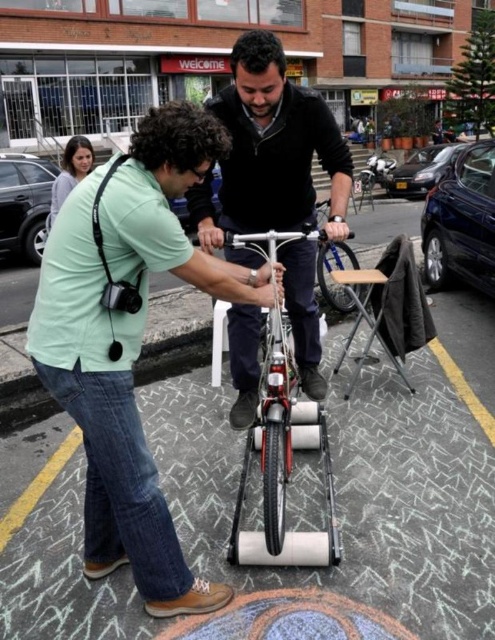
Is white textured pavement at center to the left of matte gray sweater at upper left from the viewer's perspective?

No, white textured pavement at center is not to the left of matte gray sweater at upper left.

Can you confirm if white textured pavement at center is thinner than matte gray sweater at upper left?

No, white textured pavement at center is not thinner than matte gray sweater at upper left.

From the picture: Measure the distance between point (395, 202) and camera.

Point (395, 202) is 15.81 meters away from camera.

The image size is (495, 640). I want to click on white textured pavement at center, so click(x=347, y=488).

Does green matte shirt at center have a smaller size compared to matte gray sweater at upper left?

Actually, green matte shirt at center might be larger than matte gray sweater at upper left.

Is green matte shirt at center shorter than matte gray sweater at upper left?

No, green matte shirt at center is not shorter than matte gray sweater at upper left.

You are a GUI agent. You are given a task and a screenshot of the screen. Output one action in this format:
    pyautogui.click(x=<x>, y=<y>)
    Task: Click on the green matte shirt at center
    
    Given the screenshot: What is the action you would take?
    pyautogui.click(x=130, y=340)

Does white textured pavement at center lie in front of green matte shirt at center?

No, it is not.

Can you confirm if white textured pavement at center is positioned to the right of green matte shirt at center?

Yes, white textured pavement at center is to the right of green matte shirt at center.

Is point (196, 452) in front of point (110, 396)?

No, (196, 452) is further to viewer.

Locate an element on the screen. white textured pavement at center is located at coordinates (347, 488).